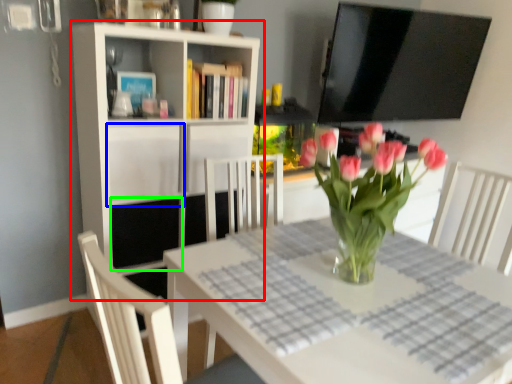
Question: Estimate the real-world distances between objects in this image. Which object is closer to shelf (highlighted by a red box), cabinet (highlighted by a blue box) or shelf (highlighted by a green box)?

Choices:
 (A) cabinet
 (B) shelf

Answer: (A)